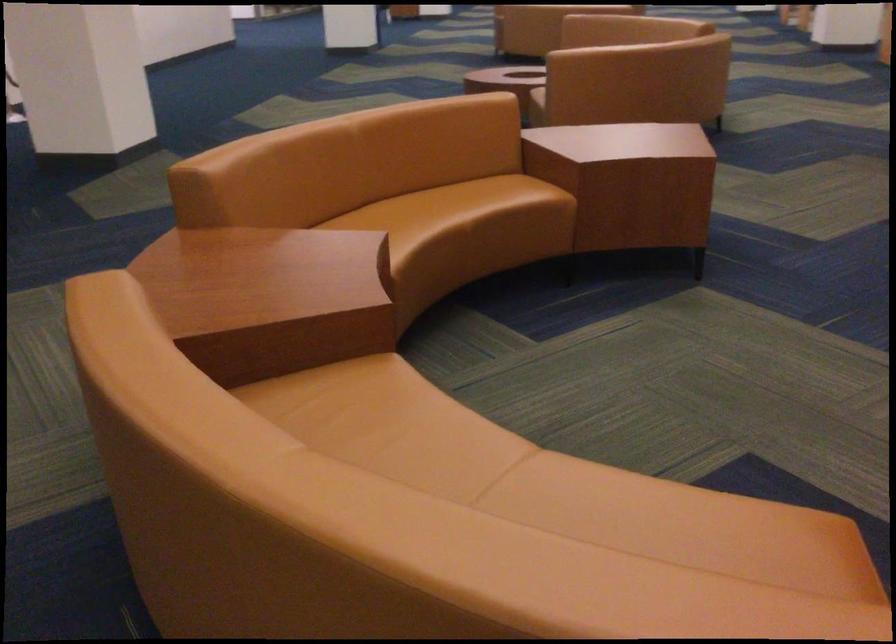
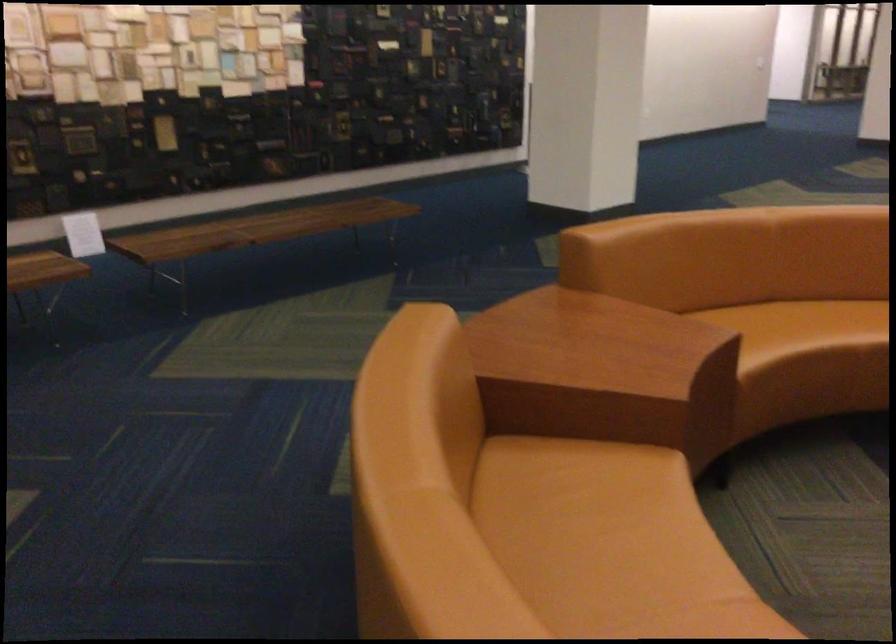
Question: The camera is either moving clockwise (left) or counter-clockwise (right) around the object. The first image is from the beginning of the video and the second image is from the end. Is the camera moving left or right when shooting the video?

Choices:
 (A) Left
 (B) Right

Answer: (B)